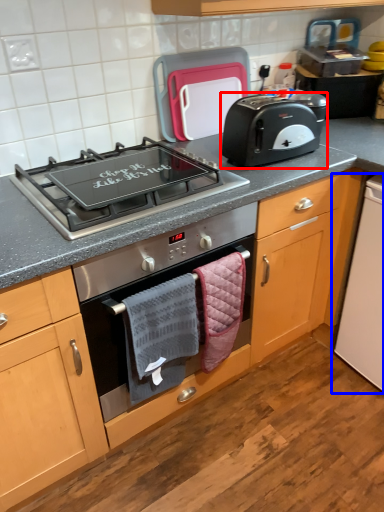
Question: Which object appears closest to the camera in this image, toaster (highlighted by a red box) or appliance (highlighted by a blue box)?

Choices:
 (A) toaster
 (B) appliance

Answer: (A)